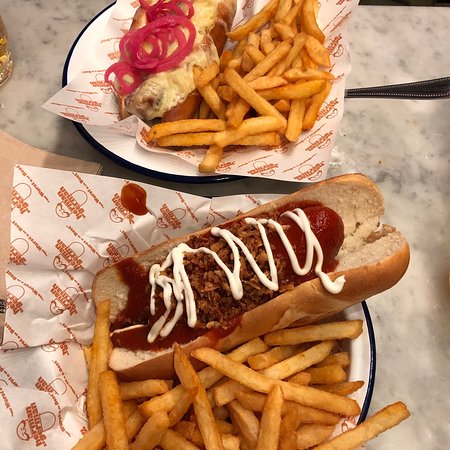
You are a GUI agent. You are given a task and a screenshot of the screen. Output one action in this format:
    pyautogui.click(x=<x>, y=<y>)
    Task: Click on the countertop or surface looks like marble
    This screenshot has width=450, height=450.
    Given the screenshot: What is the action you would take?
    pyautogui.click(x=381, y=119), pyautogui.click(x=398, y=331)